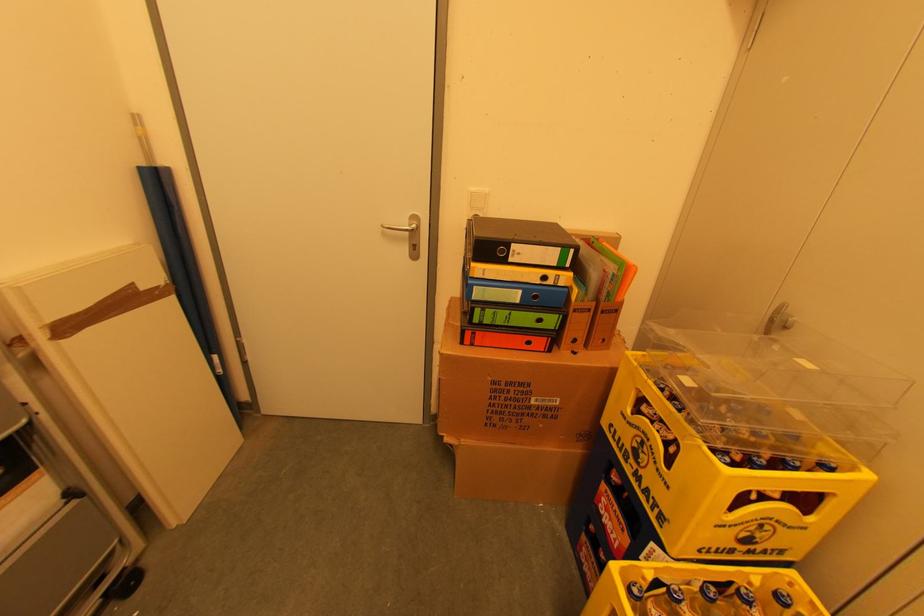
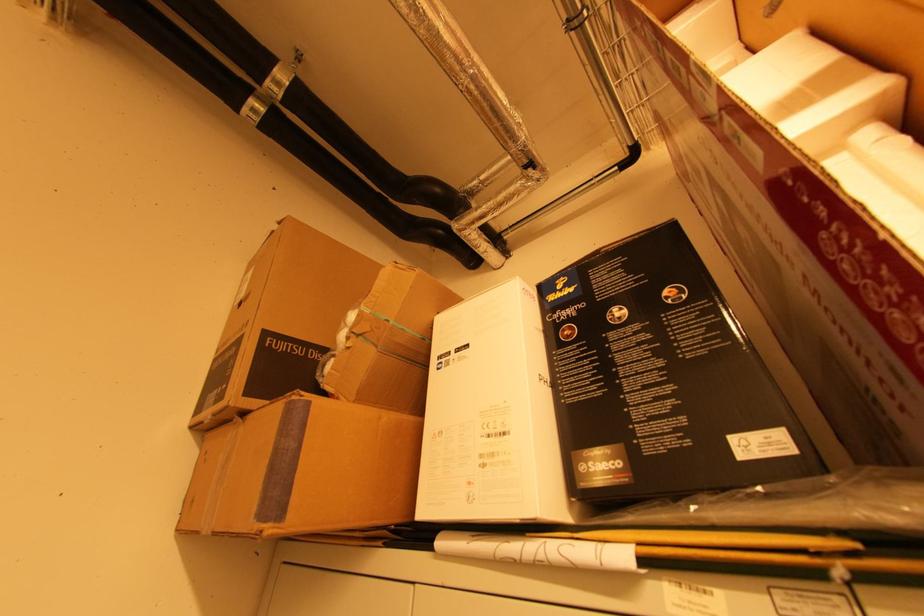
In the scene shown: How did the camera likely rotate?

The camera's rotation is toward right-up.